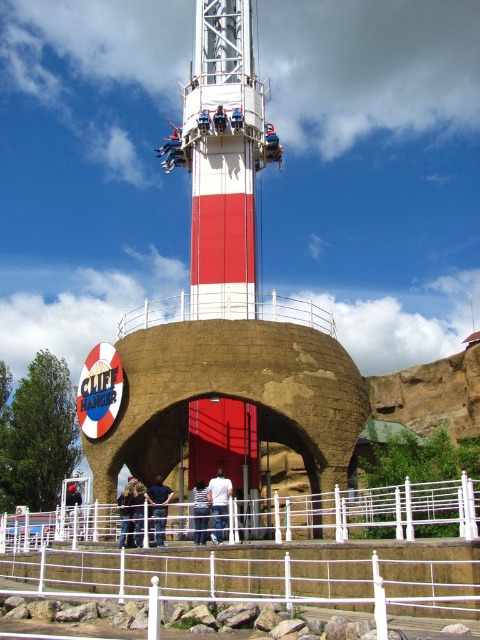
Is white metal fence at lower center shorter than dark blue shirt at center?

Incorrect, white metal fence at lower center's height does not fall short of dark blue shirt at center's.

Between white metal fence at lower center and dark blue shirt at center, which one appears on the left side from the viewer's perspective?

white metal fence at lower center is more to the left.

The width and height of the screenshot is (480, 640). What do you see at coordinates (266, 557) in the screenshot? I see `white metal fence at lower center` at bounding box center [266, 557].

Where is `white metal fence at lower center`? white metal fence at lower center is located at coordinates (266, 557).

Does white painted metal tower at center have a lesser height compared to dark blue jeans at center?

No, white painted metal tower at center is not shorter than dark blue jeans at center.

Is white painted metal tower at center taller than dark blue jeans at center?

Yes.

Locate an element on the screen. This screenshot has height=640, width=480. white painted metal tower at center is located at coordinates (228, 312).

Find the location of a particular element. The height and width of the screenshot is (640, 480). white shirt at center is located at coordinates (218, 502).

Does point (216, 536) come farther from viewer compared to point (218, 118)?

No, (216, 536) is in front of (218, 118).

Locate an element on the screen. white shirt at center is located at coordinates (218, 502).